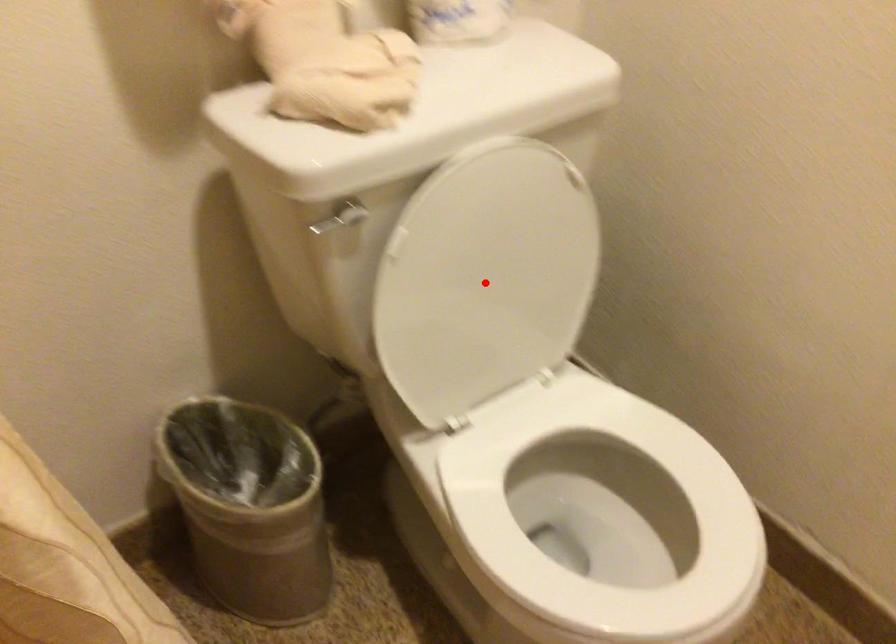
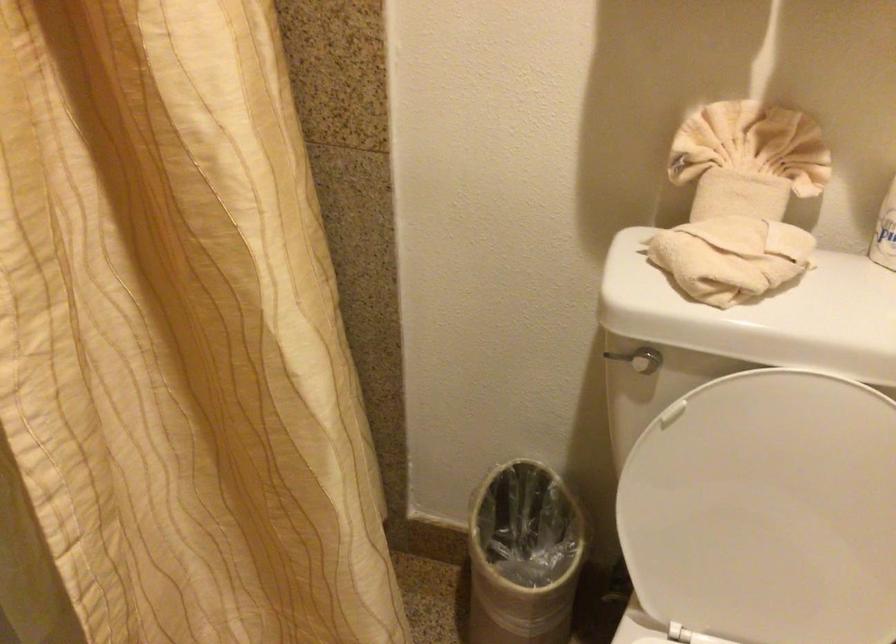
Question: I am providing you with two images of the same scene from different viewpoints. Image1 has a red point marked. In image2, the corresponding 3D location appears at what relative position? Reply with the corresponding letter.

Choices:
 (A) Closer
 (B) Farther

Answer: (A)